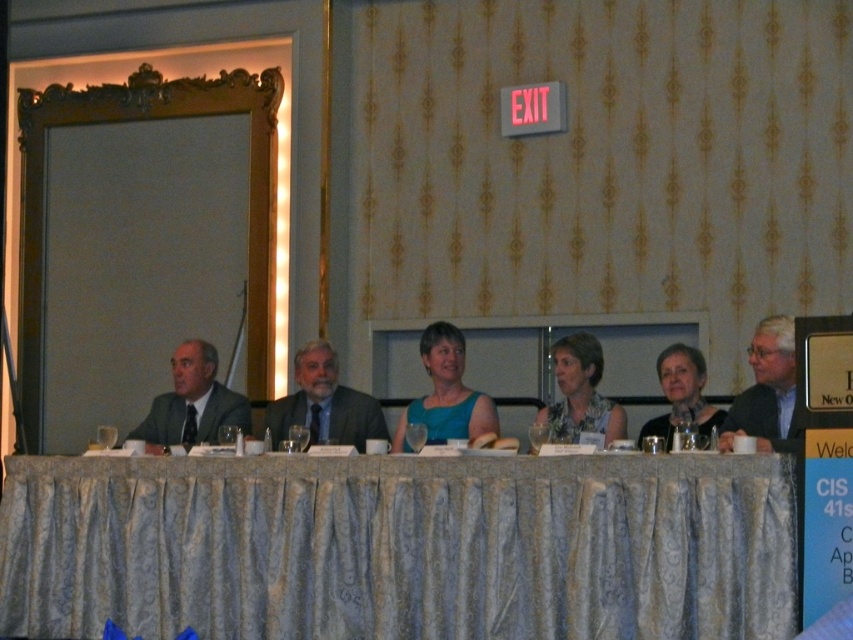
Is blue fabric tablecloth at center bigger than matte blue dress at center?

Yes, blue fabric tablecloth at center is bigger than matte blue dress at center.

Who is positioned more to the left, blue fabric tablecloth at center or matte blue dress at center?

From the viewer's perspective, blue fabric tablecloth at center appears more on the left side.

Is point (328, 538) in front of point (422, 346)?

Yes.

Where is `blue fabric tablecloth at center`? The width and height of the screenshot is (853, 640). blue fabric tablecloth at center is located at coordinates (399, 547).

Between matte gray suit at center and gray suit at left, which one is positioned higher?

Positioned higher is gray suit at left.

Which of these two, matte gray suit at center or gray suit at left, stands shorter?

Standing shorter between the two is gray suit at left.

Is point (305, 422) in front of point (202, 417)?

Yes, point (305, 422) is closer to viewer.

Locate an element on the screen. matte gray suit at center is located at coordinates (323, 403).

Does blue floral dress at center appear on the left side of matte black dress at center?

Indeed, blue floral dress at center is positioned on the left side of matte black dress at center.

Who is more distant from viewer, (613, 428) or (711, 422)?

The point (613, 428) is more distant.

At what (x,y) coordinates should I click in order to perform the action: click on blue floral dress at center. Please return your answer as a coordinate pair (x, y). The width and height of the screenshot is (853, 640). Looking at the image, I should click on (579, 394).